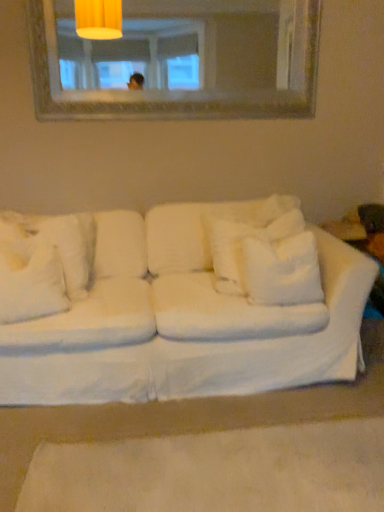
Question: Is white fluffy pillow at left, arranged as the first pillow when viewed from the left, inside the boundaries of white fluffy pillow at center, the 2th pillow in the right-to-left sequence, or outside?

Choices:
 (A) inside
 (B) outside

Answer: (B)

Question: Is point (84, 243) positioned closer to the camera than point (249, 220)?

Choices:
 (A) farther
 (B) closer

Answer: (B)

Question: Based on their relative distances, which object is nearer to the white fluffy pillow at center, the 2th pillow in the right-to-left sequence?

Choices:
 (A) white fluffy pillow at left, the 4th pillow from the right
 (B) white soft pillow at center, arranged as the 1th pillow when viewed from the right
 (C) white fabric couch at center
 (D) wooden frame mirror at upper center
 (E) white fluffy pillow at left, the 2th pillow viewed from the left

Answer: (B)

Question: Estimate the real-world distances between objects in this image. Which object is farther from the white fluffy pillow at left, which ranks as the 3th pillow in right-to-left order?

Choices:
 (A) wooden frame mirror at upper center
 (B) white fabric couch at center
 (C) white fluffy pillow at center, the 2th pillow in the right-to-left sequence
 (D) white fluffy pillow at left, arranged as the first pillow when viewed from the left
 (E) white soft pillow at center, arranged as the 1th pillow when viewed from the right

Answer: (A)